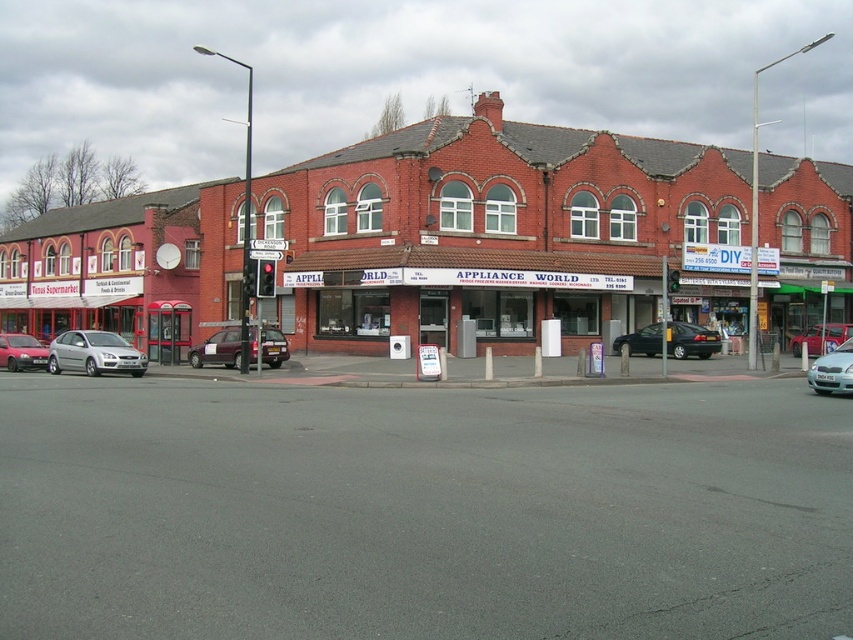
Question: Observing the image, what is the correct spatial positioning of silver metallic car at left in reference to metallic purple van at center?

Choices:
 (A) above
 (B) below

Answer: (A)

Question: Can you confirm if silver metallic car at left is positioned below shiny black sedan at center?

Choices:
 (A) yes
 (B) no

Answer: (B)

Question: Which object is closer to the camera taking this photo?

Choices:
 (A) metallic purple van at center
 (B) silver metallic sedan at left
 (C) silver metallic car at left

Answer: (C)

Question: Which of the following is the farthest from the observer?

Choices:
 (A) metallic purple van at center
 (B) silver metallic sedan at left
 (C) silver metallic car at left

Answer: (A)

Question: Is silver metallic car at center below metallic silver car at center?

Choices:
 (A) yes
 (B) no

Answer: (A)

Question: Which of these objects is positioned farthest from the gray asphalt at center?

Choices:
 (A) shiny black sedan at center
 (B) silver metallic sedan at left

Answer: (B)